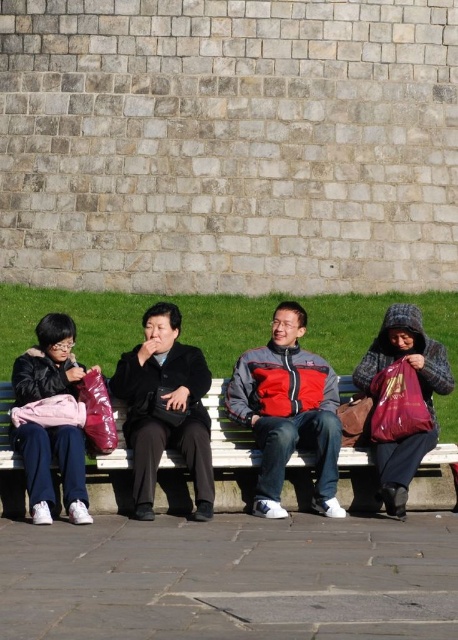
Who is taller, red and gray jacket at center or matte black jacket at left?

With more height is red and gray jacket at center.

Does red and gray jacket at center come behind matte black jacket at left?

That is True.

Is point (281, 371) farther from viewer compared to point (70, 476)?

That is True.

This screenshot has width=458, height=640. I want to click on red and gray jacket at center, so (x=288, y=412).

Between black matte coat at center and plaid woolen hat at right, which one has less height?

plaid woolen hat at right is shorter.

Looking at this image, can you confirm if black matte coat at center is positioned to the right of plaid woolen hat at right?

No, black matte coat at center is not to the right of plaid woolen hat at right.

Where is `black matte coat at center`? The width and height of the screenshot is (458, 640). black matte coat at center is located at coordinates (164, 408).

Where is `white wooden bench at center`? This screenshot has height=640, width=458. white wooden bench at center is located at coordinates (x=229, y=452).

Can you confirm if white wooden bench at center is wider than black matte coat at center?

Indeed, white wooden bench at center has a greater width compared to black matte coat at center.

Who is more forward, (x=119, y=504) or (x=130, y=408)?

Positioned in front is point (x=119, y=504).

Where is `white wooden bench at center`? white wooden bench at center is located at coordinates (229, 452).